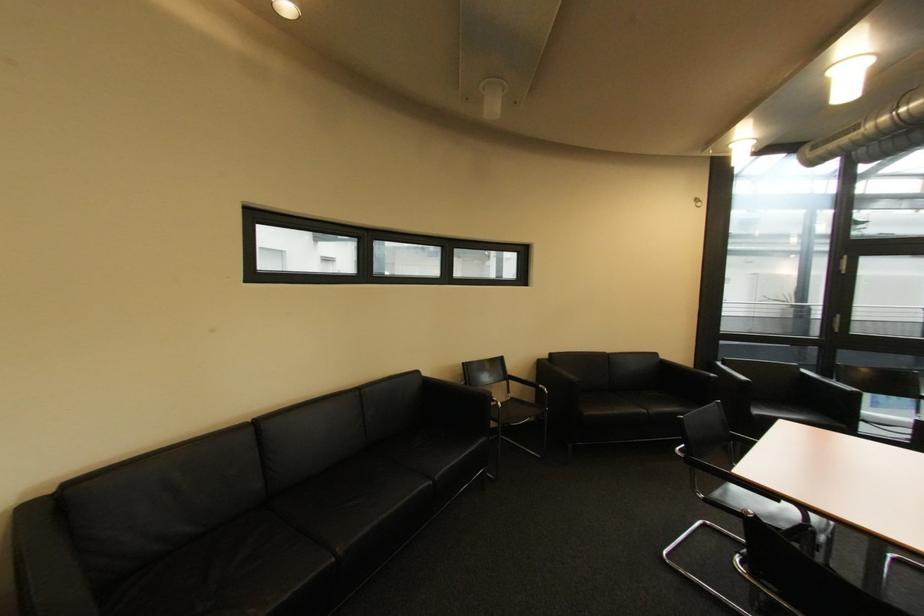
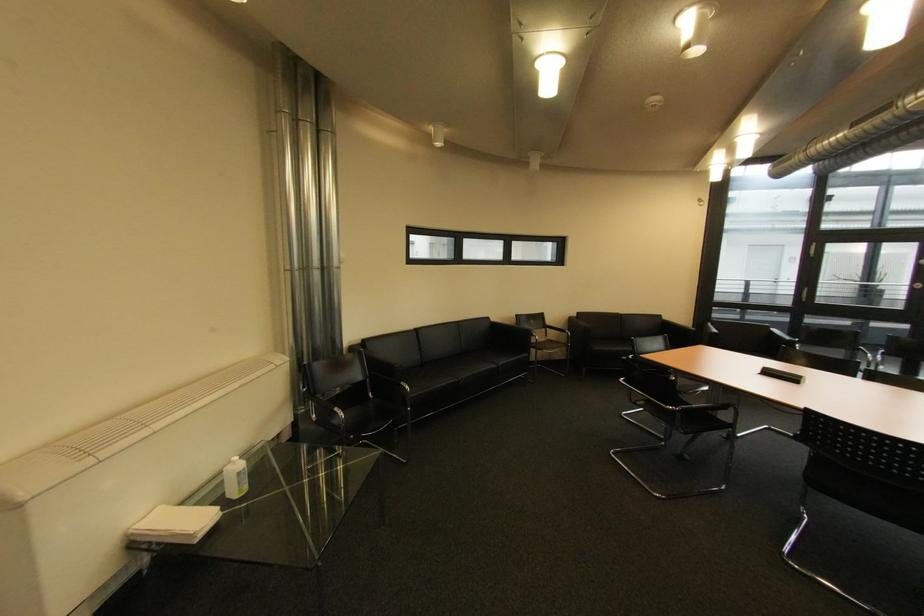
Where in the second image is the point corresponding to [342,561] from the first image?

(465, 382)